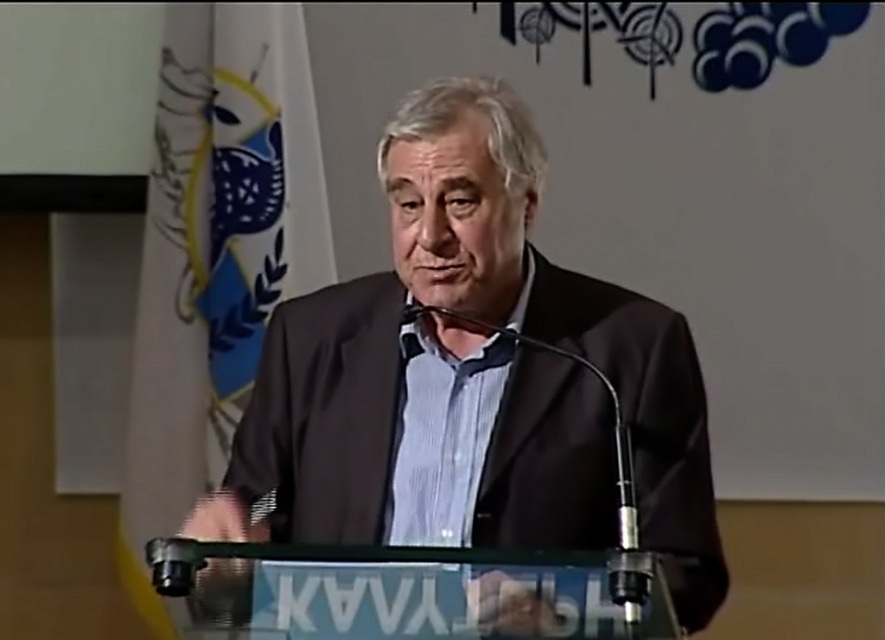
Question: Can you confirm if dark blue shirt at center is wider than white fabric flag at upper left?

Choices:
 (A) no
 (B) yes

Answer: (B)

Question: Does dark blue shirt at center come behind white fabric flag at upper left?

Choices:
 (A) no
 (B) yes

Answer: (A)

Question: Among these objects, which one is nearest to the camera?

Choices:
 (A) white fabric flag at upper left
 (B) dark blue shirt at center

Answer: (B)

Question: Is dark blue shirt at center positioned behind white fabric flag at upper left?

Choices:
 (A) no
 (B) yes

Answer: (A)

Question: Among these objects, which one is nearest to the camera?

Choices:
 (A) dark blue shirt at center
 (B) white fabric flag at upper left

Answer: (A)